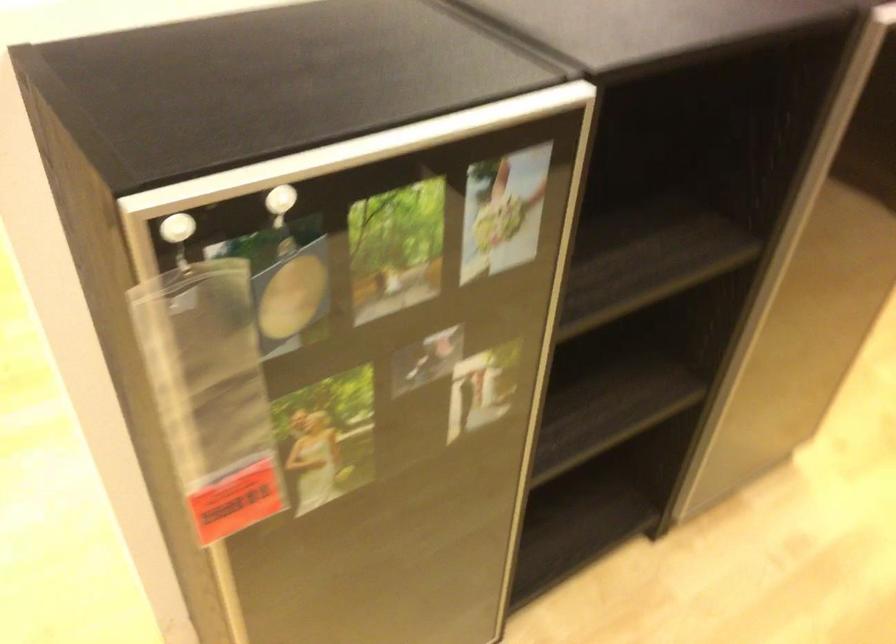
Find the location of a particular element. clear plastic pouch is located at coordinates (204, 368).